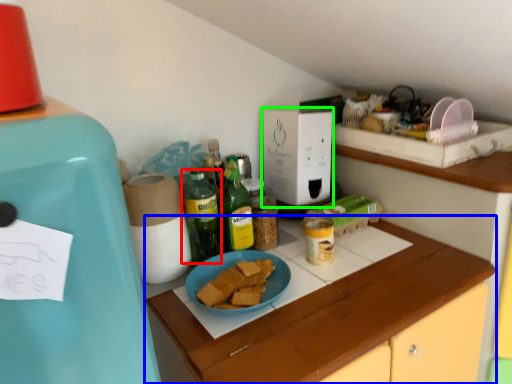
Question: Considering the real-world distances, which object is farthest from bottle (highlighted by a red box)? cabinetry (highlighted by a blue box) or box (highlighted by a green box)?

Choices:
 (A) cabinetry
 (B) box

Answer: (A)